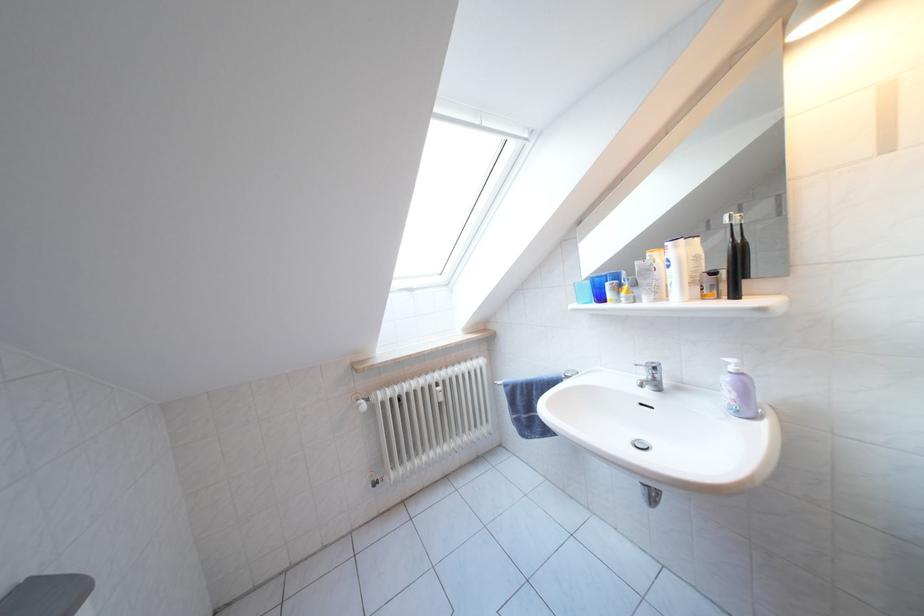
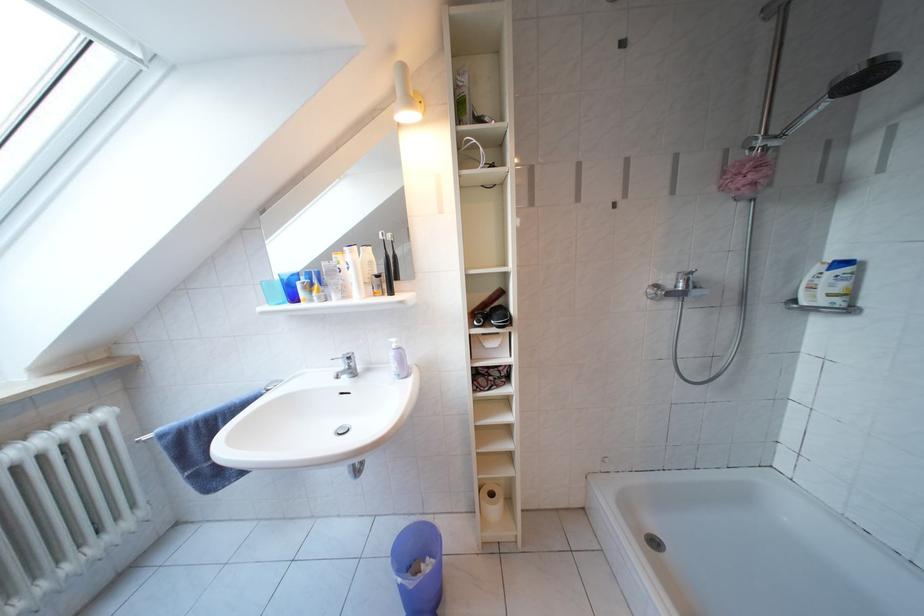
The point at [736,400] is marked in the first image. Where is the corresponding point in the second image?

(402, 371)